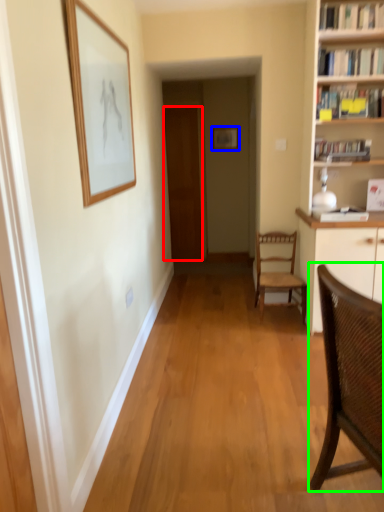
Question: Considering the real-world distances, which object is farthest from door (highlighted by a red box)? picture frame (highlighted by a blue box) or chair (highlighted by a green box)?

Choices:
 (A) picture frame
 (B) chair

Answer: (B)